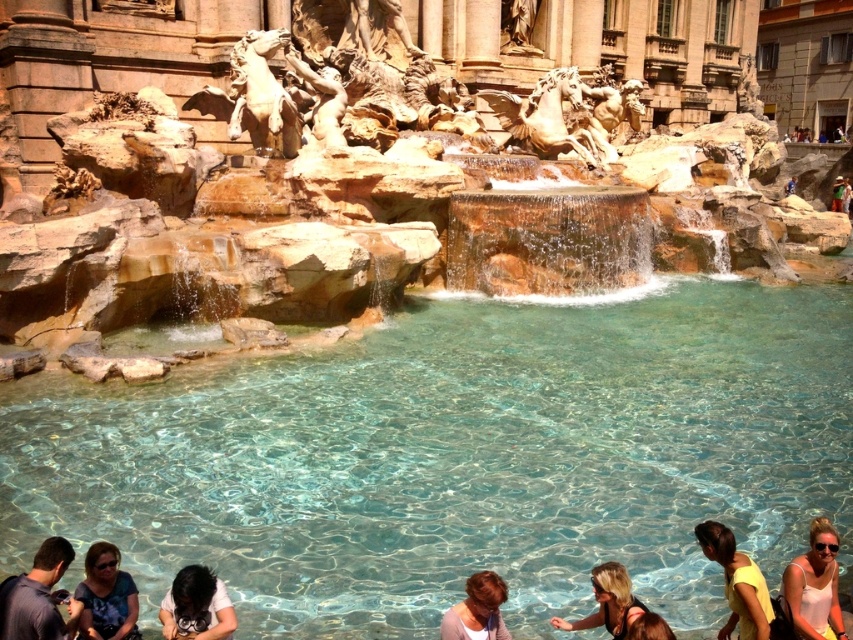
Question: Which point appears farthest from the camera in this image?

Choices:
 (A) (492, 600)
 (B) (109, 632)

Answer: (A)

Question: Is dark brown hair at lower left positioned behind brown leather bag at lower center?

Choices:
 (A) no
 (B) yes

Answer: (B)

Question: Can you confirm if matte blue sunglasses at lower left is bigger than brown leather bag at lower center?

Choices:
 (A) yes
 (B) no

Answer: (A)

Question: Is dark brown hair at lower left smaller than black swimsuit at lower center?

Choices:
 (A) no
 (B) yes

Answer: (B)

Question: Estimate the real-world distances between objects in this image. Which object is farther from the light brown hair at lower center?

Choices:
 (A) brown leather bag at lower center
 (B) clear glass swimming pool at center
 (C) dark gray shirt at lower left
 (D) matte blue sunglasses at lower left

Answer: (B)

Question: Estimate the real-world distances between objects in this image. Which object is farther from the brown leather bag at lower center?

Choices:
 (A) dark gray shirt at lower left
 (B) matte blue sunglasses at lower left
 (C) black swimsuit at lower center
 (D) dark brown hair at lower left

Answer: (A)